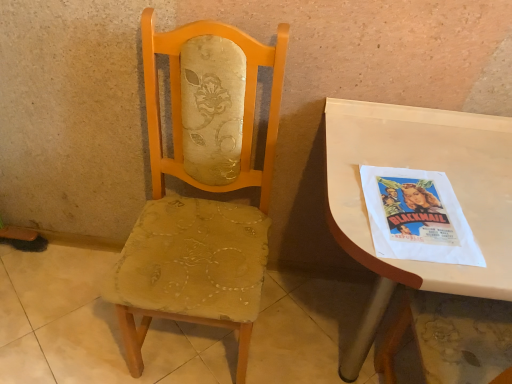
Image resolution: width=512 pixels, height=384 pixels. I want to click on vacant area on top of white paper poster at right (from a real-world perspective), so click(417, 207).